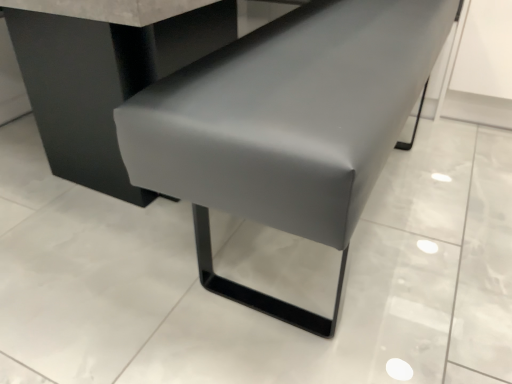
Question: In terms of height, does matte gray bench at center look taller or shorter compared to matte gray concrete at center?

Choices:
 (A) short
 (B) tall

Answer: (A)

Question: Considering the relative positions of matte gray bench at center and matte gray concrete at center in the image provided, is matte gray bench at center to the left or to the right of matte gray concrete at center?

Choices:
 (A) right
 (B) left

Answer: (A)

Question: From a real-world perspective, is matte gray bench at center positioned above or below matte gray concrete at center?

Choices:
 (A) above
 (B) below

Answer: (B)

Question: Considering the positions of matte gray concrete at center and matte gray bench at center in the image, is matte gray concrete at center wider or thinner than matte gray bench at center?

Choices:
 (A) wide
 (B) thin

Answer: (A)

Question: Considering the positions of matte gray concrete at center and matte gray bench at center in the image, is matte gray concrete at center taller or shorter than matte gray bench at center?

Choices:
 (A) tall
 (B) short

Answer: (A)

Question: Is matte gray concrete at center in front of or behind matte gray bench at center in the image?

Choices:
 (A) front
 (B) behind

Answer: (B)

Question: Is matte gray concrete at center situated inside matte gray bench at center or outside?

Choices:
 (A) outside
 (B) inside

Answer: (A)